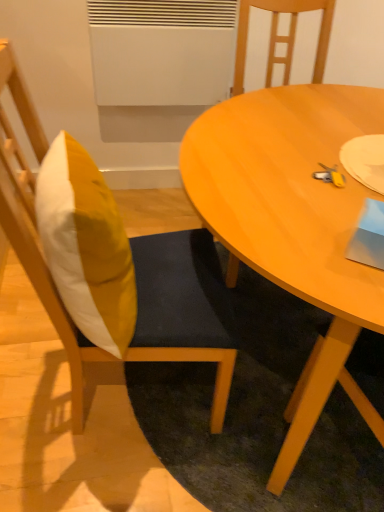
I want to click on free location to the left of wooden chair at left, acting as the second chair starting from the right, so click(x=27, y=367).